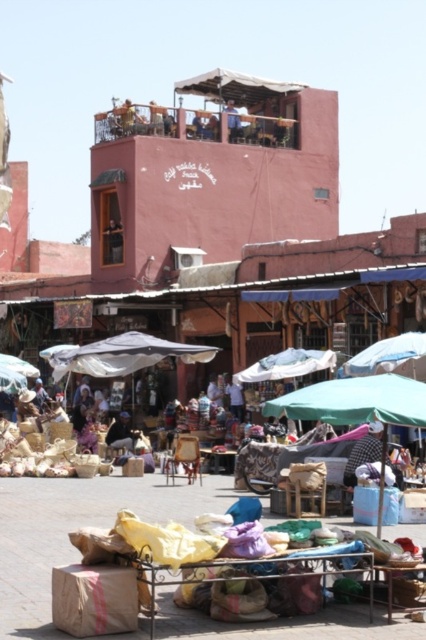
Question: Which object is farther from the camera taking this photo?

Choices:
 (A) dark blue fabric at center
 (B) white cotton shirt at center

Answer: (A)

Question: Is the position of dark blue fabric at center more distant than that of blue fabric umbrella at upper center?

Choices:
 (A) no
 (B) yes

Answer: (A)

Question: Is white cotton shirt at center positioned behind dark blue fabric at center?

Choices:
 (A) no
 (B) yes

Answer: (A)

Question: Which object appears closest to the camera in this image?

Choices:
 (A) white cotton shirt at center
 (B) yellow fabric at center

Answer: (B)

Question: Which object is farther from the camera taking this photo?

Choices:
 (A) blue fabric umbrella at upper center
 (B) white cotton shirt at center
 (C) dark blue fabric at center

Answer: (A)

Question: Where is white cotton shirt at center located in relation to blue fabric umbrella at upper center in the image?

Choices:
 (A) left
 (B) right

Answer: (B)